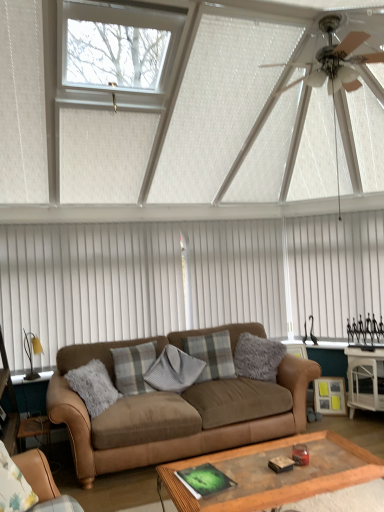
Question: From the image's perspective, is fuzzy gray pillow at center, the fourth pillow when ordered from left to right, located above white vertical blinds at upper center?

Choices:
 (A) no
 (B) yes

Answer: (A)

Question: Does fuzzy gray pillow at center, the fourth pillow when ordered from left to right, come behind white vertical blinds at upper center?

Choices:
 (A) yes
 (B) no

Answer: (B)

Question: Is fuzzy gray pillow at center, which ranks as the 1th pillow in right-to-left order, oriented towards white vertical blinds at upper center?

Choices:
 (A) no
 (B) yes

Answer: (A)

Question: Is fuzzy gray pillow at center, the fourth pillow when ordered from left to right, to the left of white vertical blinds at upper center from the viewer's perspective?

Choices:
 (A) no
 (B) yes

Answer: (B)

Question: Is fuzzy gray pillow at center, the fourth pillow when ordered from left to right, far from white vertical blinds at upper center?

Choices:
 (A) no
 (B) yes

Answer: (B)

Question: Considering the positions of wooden glass coffee table at center and white vertical blinds at center in the image, is wooden glass coffee table at center taller or shorter than white vertical blinds at center?

Choices:
 (A) tall
 (B) short

Answer: (B)

Question: Is wooden glass coffee table at center in front of or behind white vertical blinds at center in the image?

Choices:
 (A) behind
 (B) front

Answer: (B)

Question: From a real-world perspective, is wooden glass coffee table at center physically located above or below white vertical blinds at center?

Choices:
 (A) above
 (B) below

Answer: (B)

Question: Considering the positions of point (253, 448) and point (61, 334), is point (253, 448) closer or farther from the camera than point (61, 334)?

Choices:
 (A) closer
 (B) farther

Answer: (A)

Question: Is fuzzy gray pillow at center, the fourth pillow when ordered from left to right, taller or shorter than plaid fabric pillow at center, which appears as the 4th pillow when viewed from the right?

Choices:
 (A) tall
 (B) short

Answer: (A)

Question: Does point (264, 352) appear closer or farther from the camera than point (127, 360)?

Choices:
 (A) closer
 (B) farther

Answer: (B)

Question: Considering their positions, is fuzzy gray pillow at center, the fourth pillow when ordered from left to right, located in front of or behind plaid fabric pillow at center, which appears as the 4th pillow when viewed from the right?

Choices:
 (A) behind
 (B) front

Answer: (A)

Question: From a real-world perspective, is fuzzy gray pillow at center, the fourth pillow when ordered from left to right, physically located above or below plaid fabric pillow at center, which appears as the 4th pillow when viewed from the right?

Choices:
 (A) below
 (B) above

Answer: (B)

Question: From a real-world perspective, relative to metallic silver ceiling fan at upper right, is white glossy side table at lower right vertically above or below?

Choices:
 (A) below
 (B) above

Answer: (A)

Question: Visually, is white glossy side table at lower right positioned to the left or to the right of metallic silver ceiling fan at upper right?

Choices:
 (A) left
 (B) right

Answer: (B)